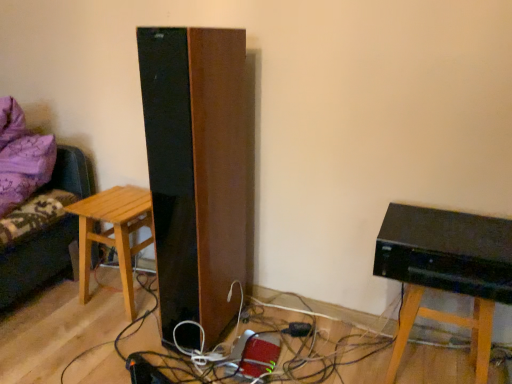
Question: From the image's perspective, is black glossy computer at lower right beneath purple fabric couch at left?

Choices:
 (A) no
 (B) yes

Answer: (B)

Question: Is black glossy computer at lower right in contact with purple fabric couch at left?

Choices:
 (A) no
 (B) yes

Answer: (A)

Question: Is black glossy computer at lower right positioned before purple fabric couch at left?

Choices:
 (A) yes
 (B) no

Answer: (A)

Question: Is black glossy computer at lower right oriented towards purple fabric couch at left?

Choices:
 (A) yes
 (B) no

Answer: (B)

Question: Is black glossy computer at lower right further to camera compared to purple fabric couch at left?

Choices:
 (A) yes
 (B) no

Answer: (B)

Question: Is light brown wooden stool at left spatially inside purple fabric couch at left, or outside of it?

Choices:
 (A) inside
 (B) outside

Answer: (B)

Question: Considering the positions of light brown wooden stool at left and purple fabric couch at left in the image, is light brown wooden stool at left wider or thinner than purple fabric couch at left?

Choices:
 (A) wide
 (B) thin

Answer: (B)

Question: From the image's perspective, relative to purple fabric couch at left, is light brown wooden stool at left above or below?

Choices:
 (A) above
 (B) below

Answer: (B)

Question: Considering the positions of point click(90, 253) and point click(29, 208), is point click(90, 253) closer or farther from the camera than point click(29, 208)?

Choices:
 (A) closer
 (B) farther

Answer: (B)

Question: Visually, is black glossy computer at lower right positioned to the left or to the right of black plastic plug at lower center?

Choices:
 (A) right
 (B) left

Answer: (A)

Question: From a real-world perspective, is black glossy computer at lower right positioned above or below black plastic plug at lower center?

Choices:
 (A) above
 (B) below

Answer: (A)

Question: From the image's perspective, is black glossy computer at lower right located above or below black plastic plug at lower center?

Choices:
 (A) below
 (B) above

Answer: (B)

Question: In terms of width, does black glossy computer at lower right look wider or thinner when compared to black plastic plug at lower center?

Choices:
 (A) thin
 (B) wide

Answer: (B)

Question: Looking at the image, does black plastic plug at lower center seem bigger or smaller compared to light brown wooden stool at left?

Choices:
 (A) small
 (B) big

Answer: (A)

Question: Relative to light brown wooden stool at left, is black plastic plug at lower center in front or behind?

Choices:
 (A) front
 (B) behind

Answer: (B)